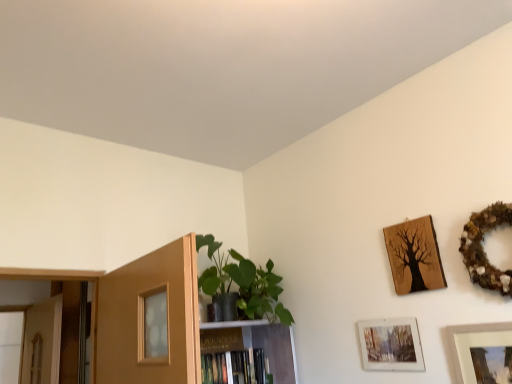
Question: Is wooden picture frame at upper right, the 1th picture frame positioned from the bottom, wider than hardcover book at center?

Choices:
 (A) yes
 (B) no

Answer: (B)

Question: Considering the relative sizes of wooden picture frame at upper right, marked as the fourth picture frame in a top-to-bottom arrangement, and hardcover book at center in the image provided, is wooden picture frame at upper right, marked as the fourth picture frame in a top-to-bottom arrangement, bigger than hardcover book at center?

Choices:
 (A) yes
 (B) no

Answer: (B)

Question: Is wooden picture frame at upper right, marked as the fourth picture frame in a top-to-bottom arrangement, at the left side of hardcover book at center?

Choices:
 (A) yes
 (B) no

Answer: (B)

Question: Is the depth of wooden picture frame at upper right, the 1th picture frame positioned from the bottom, less than that of hardcover book at center?

Choices:
 (A) no
 (B) yes

Answer: (B)

Question: From the image's perspective, is wooden picture frame at upper right, the 1th picture frame positioned from the bottom, on top of hardcover book at center?

Choices:
 (A) no
 (B) yes

Answer: (B)

Question: From a real-world perspective, is wooden picture frame at upper right, marked as the fourth picture frame in a top-to-bottom arrangement, beneath hardcover book at center?

Choices:
 (A) no
 (B) yes

Answer: (B)

Question: Is matte glass picture frame at lower right, the 3th picture frame positioned from the top, beside wooden tree art at upper right, acting as the 3th picture frame starting from the bottom?

Choices:
 (A) no
 (B) yes

Answer: (A)

Question: Can you confirm if matte glass picture frame at lower right, which is the 2th picture frame in bottom-to-top order, is bigger than wooden tree art at upper right, acting as the 3th picture frame starting from the bottom?

Choices:
 (A) yes
 (B) no

Answer: (B)

Question: Is matte glass picture frame at lower right, which is the 2th picture frame in bottom-to-top order, wider than wooden tree art at upper right, placed as the second picture frame when sorted from top to bottom?

Choices:
 (A) no
 (B) yes

Answer: (A)

Question: Considering the relative positions of matte glass picture frame at lower right, the 3th picture frame positioned from the top, and wooden tree art at upper right, acting as the 3th picture frame starting from the bottom, in the image provided, is matte glass picture frame at lower right, the 3th picture frame positioned from the top, to the left of wooden tree art at upper right, acting as the 3th picture frame starting from the bottom, from the viewer's perspective?

Choices:
 (A) no
 (B) yes

Answer: (B)

Question: Is wooden tree art at upper right, acting as the 3th picture frame starting from the bottom, surrounded by matte glass picture frame at lower right, the 3th picture frame positioned from the top?

Choices:
 (A) yes
 (B) no

Answer: (B)

Question: Considering the relative sizes of matte glass picture frame at lower right, which is the 2th picture frame in bottom-to-top order, and wooden tree art at upper right, acting as the 3th picture frame starting from the bottom, in the image provided, is matte glass picture frame at lower right, which is the 2th picture frame in bottom-to-top order, shorter than wooden tree art at upper right, acting as the 3th picture frame starting from the bottom,?

Choices:
 (A) yes
 (B) no

Answer: (A)

Question: Is wooden picture frame at upper right, marked as the fourth picture frame in a top-to-bottom arrangement, next to matte glass picture frame at lower right, the 3th picture frame positioned from the top?

Choices:
 (A) no
 (B) yes

Answer: (A)